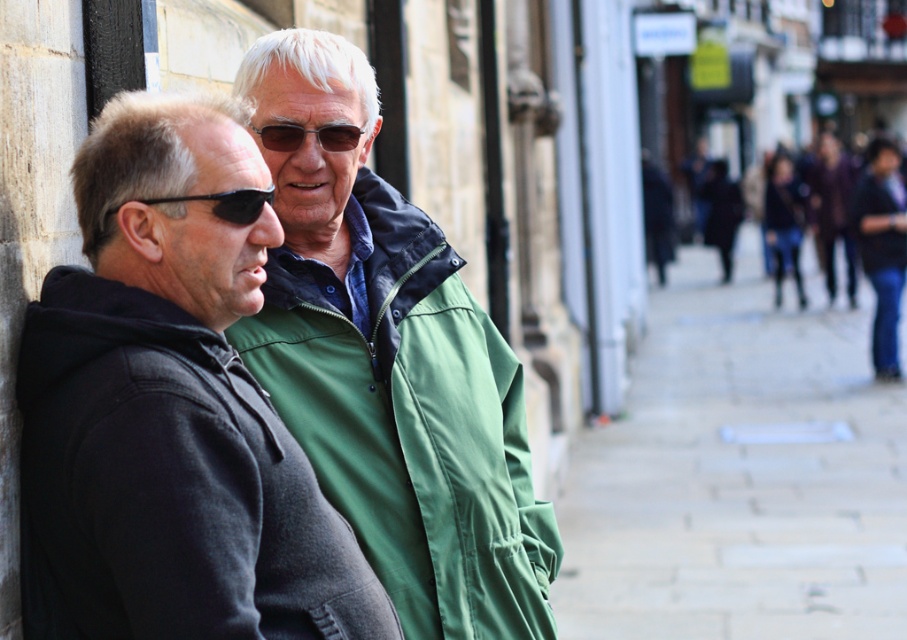
Is green fabric jacket at center positioned at the back of denim jacket at right?

No, green fabric jacket at center is in front of denim jacket at right.

Between point (379, 472) and point (773, 236), which one is positioned behind?

Positioned behind is point (773, 236).

Identify the location of green fabric jacket at center. (411, 426).

Does matte black hoodie at left lie in front of black fleece jacket at left?

No, it is behind black fleece jacket at left.

Find the location of a particular element. The height and width of the screenshot is (640, 907). matte black hoodie at left is located at coordinates (391, 365).

Is paved stone sidewalk at center to the left of black matte sunglasses at left from the viewer's perspective?

No, paved stone sidewalk at center is not to the left of black matte sunglasses at left.

Between point (610, 525) and point (232, 218), which one is positioned in front?

Point (232, 218)

Where is `paved stone sidewalk at center`? paved stone sidewalk at center is located at coordinates [740, 474].